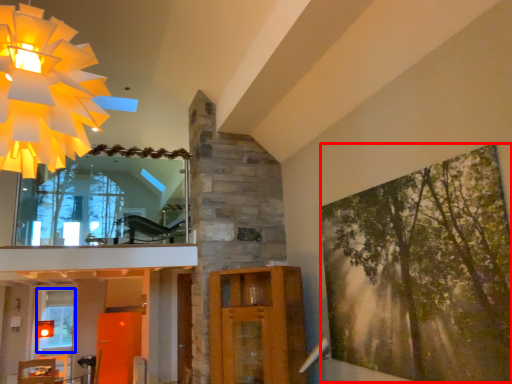
Question: Among these objects, which one is nearest to the camera, tree (highlighted by a red box) or window (highlighted by a blue box)?

Choices:
 (A) tree
 (B) window

Answer: (A)